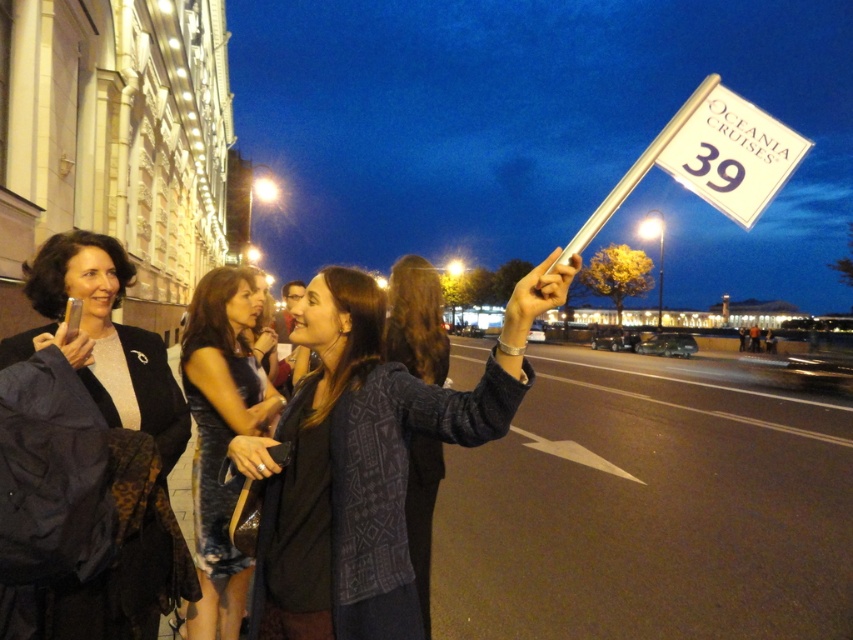
Question: Is shiny metallic dress at center thinner than matte black jacket at left?

Choices:
 (A) yes
 (B) no

Answer: (A)

Question: Which of the following is the farthest from the observer?

Choices:
 (A) (415, 573)
 (B) (770, 192)
 (C) (64, 288)
 (D) (320, 529)

Answer: (C)

Question: Can you confirm if dark blue textured sweater at center is wider than matte black jacket at left?

Choices:
 (A) no
 (B) yes

Answer: (B)

Question: Among these objects, which one is farthest from the camera?

Choices:
 (A) shiny metallic dress at center
 (B) matte black jacket at left
 (C) dark blue textured sweater at center

Answer: (A)

Question: Estimate the real-world distances between objects in this image. Which object is farther from the dark blue textured sweater at center?

Choices:
 (A) shiny metallic dress at center
 (B) white paper flag at upper right

Answer: (B)

Question: Does white paper flag at upper right appear on the left side of knitted sweater at center?

Choices:
 (A) yes
 (B) no

Answer: (B)